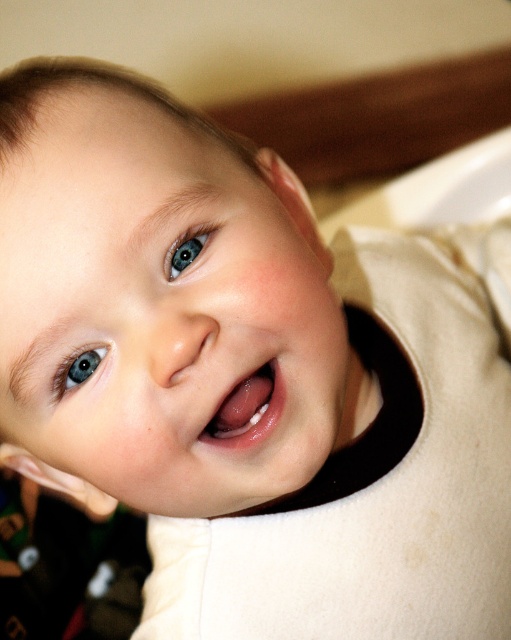
Question: Which is farther from the pink glossy tongue at center?

Choices:
 (A) blue glossy eye at upper center
 (B) blue glossy eye at upper left

Answer: (A)

Question: Based on their relative distances, which object is nearer to the pink glossy tongue at center?

Choices:
 (A) blue glossy eye at upper left
 (B) blue glossy eye at upper center

Answer: (A)

Question: Is pink glossy tongue at center thinner than blue glossy eye at upper left?

Choices:
 (A) no
 (B) yes

Answer: (A)

Question: Is blue glossy eye at upper left bigger than blue glossy eye at upper center?

Choices:
 (A) yes
 (B) no

Answer: (A)

Question: Which point is farther to the camera?

Choices:
 (A) blue glossy eye at upper left
 (B) pink glossy tongue at center

Answer: (B)

Question: Does pink glossy tongue at center have a smaller size compared to blue glossy eye at upper center?

Choices:
 (A) no
 (B) yes

Answer: (A)